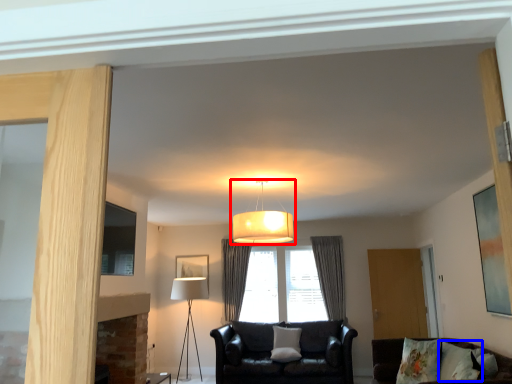
Question: Which object appears farthest to the camera in this image, lamp (highlighted by a red box) or pillow (highlighted by a blue box)?

Choices:
 (A) lamp
 (B) pillow

Answer: (A)